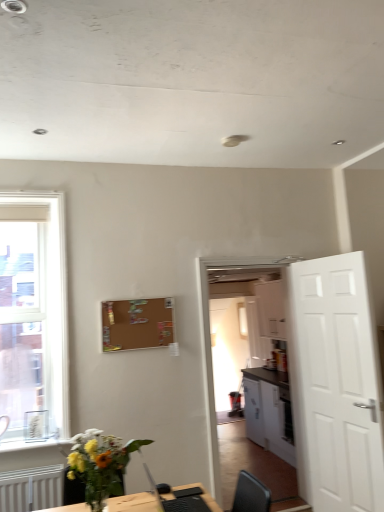
Question: From the image's perspective, relative to clear glass window at left, is white matte door at right above or below?

Choices:
 (A) below
 (B) above

Answer: (A)

Question: In the image, is white matte door at right positioned in front of or behind clear glass window at left?

Choices:
 (A) behind
 (B) front

Answer: (B)

Question: Estimate the real-world distances between objects in this image. Which object is farther from the brown matte bulletin board at upper center?

Choices:
 (A) white matte door at right
 (B) translucent glass vase at lower left
 (C) clear glass window at left
 (D) white glossy window sill at lower left
 (E) black plastic computer at lower center

Answer: (A)

Question: Which object is the closest to the white glossy cabinet at center?

Choices:
 (A) black plastic computer at lower center
 (B) white glossy window sill at lower left
 (C) clear glass window at left
 (D) white matte door at right
 (E) translucent glass vase at lower left

Answer: (D)